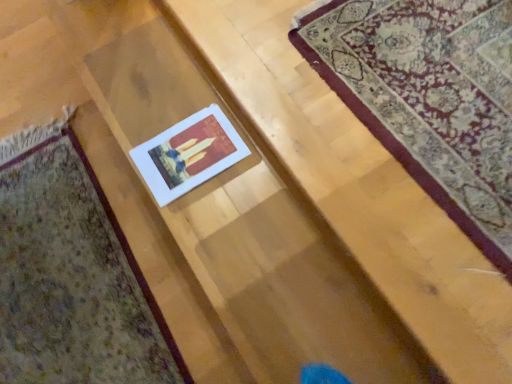
Question: Is matte paper card at center located outside white paper at center?

Choices:
 (A) no
 (B) yes

Answer: (B)

Question: From the image's perspective, is matte paper card at center under white paper at center?

Choices:
 (A) yes
 (B) no

Answer: (A)

Question: Can you confirm if matte paper card at center is shorter than white paper at center?

Choices:
 (A) no
 (B) yes

Answer: (A)

Question: Can you confirm if matte paper card at center is bigger than white paper at center?

Choices:
 (A) yes
 (B) no

Answer: (A)

Question: Is matte paper card at center turned away from white paper at center?

Choices:
 (A) yes
 (B) no

Answer: (B)

Question: From a real-world perspective, is matte paper card at center physically above white paper at center?

Choices:
 (A) no
 (B) yes

Answer: (A)

Question: Is white paper at center not near white paper at center?

Choices:
 (A) no
 (B) yes

Answer: (A)

Question: Is white paper at center facing towards white paper at center?

Choices:
 (A) yes
 (B) no

Answer: (B)

Question: Can you confirm if white paper at center is shorter than white paper at center?

Choices:
 (A) yes
 (B) no

Answer: (A)

Question: Is white paper at center positioned with its back to white paper at center?

Choices:
 (A) no
 (B) yes

Answer: (A)

Question: Does white paper at center have a greater height compared to white paper at center?

Choices:
 (A) no
 (B) yes

Answer: (A)

Question: Would you say white paper at center contains white paper at center?

Choices:
 (A) no
 (B) yes

Answer: (A)

Question: Can you confirm if white paper at center is taller than matte paper card at center?

Choices:
 (A) no
 (B) yes

Answer: (A)